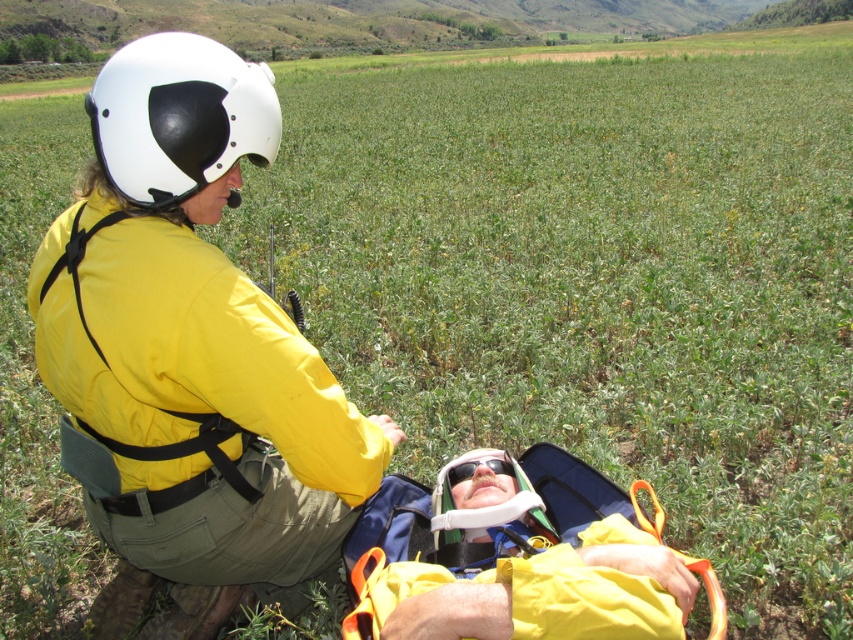
Consider the image. You are a first responder assessing the scene. You notice two items at the center of the image. Which item is positioned to the right when looking at the yellow fabric at center and the black plastic goggles at center?

The yellow fabric at center is positioned to the right of the black plastic goggles at center.

You are a drone operator trying to locate two specific items in an aerial view of the field. The items are the yellow fabric at center and the white matte helmet at upper left. Based on the scene description, which item is positioned lower in the image?

The yellow fabric at center is located below the white matte helmet at upper left, so the yellow fabric at center is positioned lower in the image.